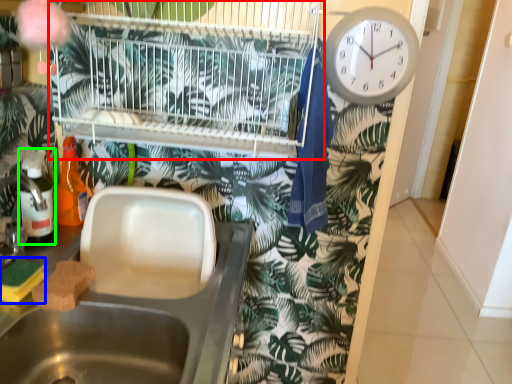
Question: Which object is the closest to the bird cage (highlighted by a red box)? Choose among these: food (highlighted by a blue box) or bottle (highlighted by a green box).

Choices:
 (A) food
 (B) bottle

Answer: (B)